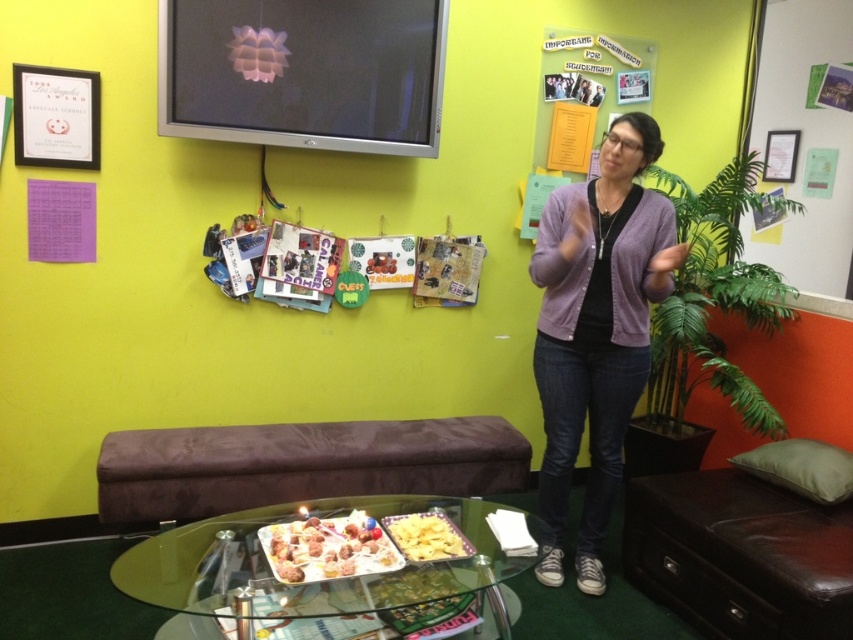
You are a guest at a party in this room and want to place a small gift on the purple knit cardigan at center or the shiny metallic tray at lower center. Which surface can better accommodate a tall object without it tipping over?

The purple knit cardigan at center is much taller than the shiny metallic tray at lower center, so placing a tall object on it would be more stable and less likely to tip over.

You are standing in the classroom and see the purple knit cardigan at center represented by point (x=596, y=330). If you want to place a book on the glass coffee table with rounded edge, which is located on the dark green carpeted floor, where should you move relative to the purple knit cardigan at center?

The purple knit cardigan at center is located at point (x=596, y=330). To place the book on the glass coffee table with rounded edge, you should move towards the lower area relative to the purple knit cardigan at center since the table is in the foreground and the cardigan is at the center.